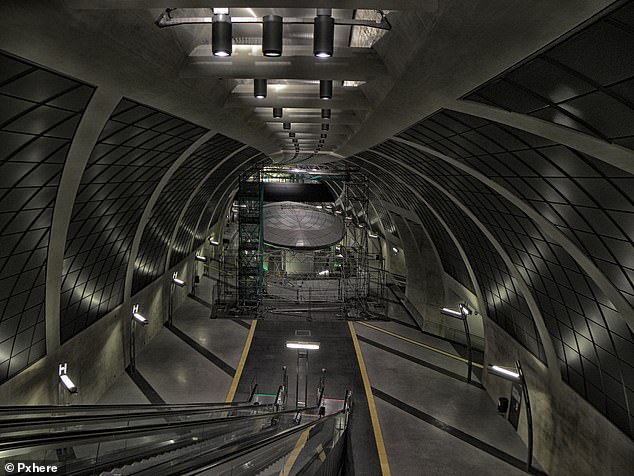
I want to click on overhead lights, so click(x=223, y=49), click(x=278, y=45), click(x=319, y=39), click(x=323, y=98), click(x=266, y=91), click(x=275, y=116), click(x=321, y=114).